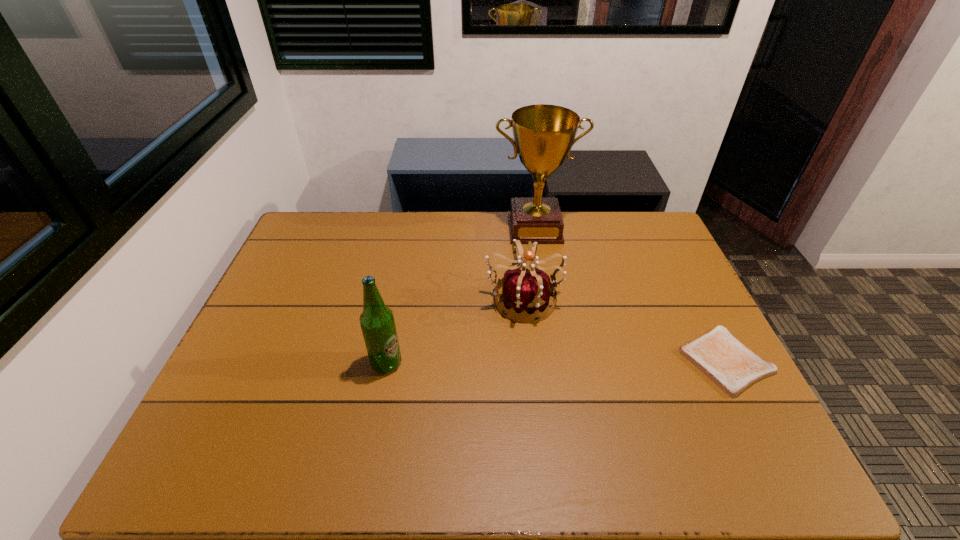
What are the coordinates of `vacant space at the far edge of the desktop` in the screenshot? It's located at (597, 215).

This screenshot has width=960, height=540. In the image, there is a desktop. Find the location of `free space at the near edge`. free space at the near edge is located at coordinates (593, 398).

At what (x,y) coordinates should I click in order to perform the action: click on vacant space at the left edge of the desktop. Please return your answer as a coordinate pair (x, y). Image resolution: width=960 pixels, height=540 pixels. Looking at the image, I should click on (260, 330).

Identify the location of blank area at the right edge. Image resolution: width=960 pixels, height=540 pixels. (676, 342).

At what (x,y) coordinates should I click in order to perform the action: click on vacant space at the far left corner of the desktop. Please return your answer as a coordinate pair (x, y). Looking at the image, I should click on (339, 218).

The width and height of the screenshot is (960, 540). Identify the location of vacant point at the far right corner. (669, 247).

At what (x,y) coordinates should I click in order to perform the action: click on vacant point located between the leftmost object and the third nearest object. Please return your answer as a coordinate pair (x, y). The image size is (960, 540). Looking at the image, I should click on [455, 332].

Where is `empty space between the tallest object and the leftmost object`? The image size is (960, 540). empty space between the tallest object and the leftmost object is located at coordinates (461, 296).

At what (x,y) coordinates should I click in order to perform the action: click on vacant area that lies between the toast and the third tallest object. Please return your answer as a coordinate pair (x, y). Image resolution: width=960 pixels, height=540 pixels. Looking at the image, I should click on (624, 330).

Where is `vacant point located between the farthest object and the beer bottle`? vacant point located between the farthest object and the beer bottle is located at coordinates (461, 296).